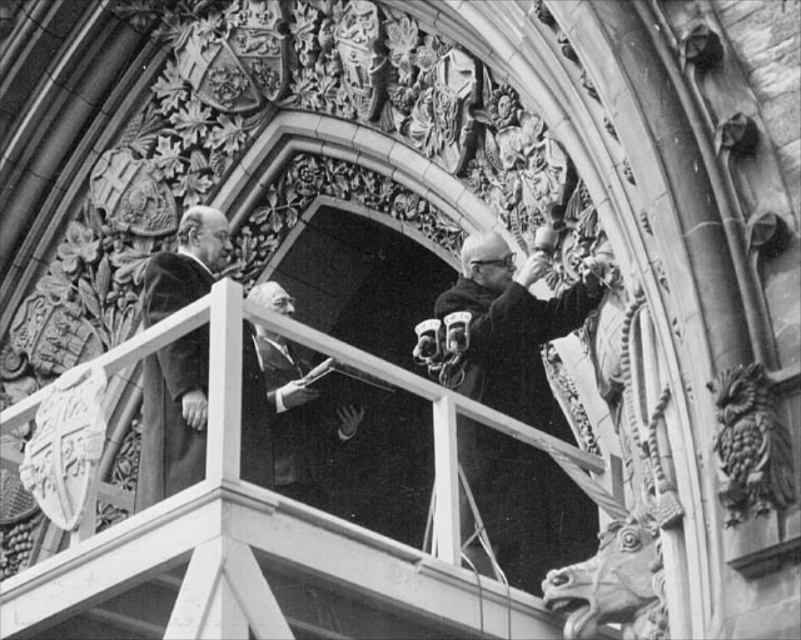
Question: Which of the following is the closest to the observer?

Choices:
 (A) (304, 369)
 (B) (578, 289)
 (C) (155, 260)
 (D) (220, 468)

Answer: (D)

Question: Can you confirm if dark wool coat at center is positioned to the left of smooth black suit at center?

Choices:
 (A) yes
 (B) no

Answer: (B)

Question: Which of the following is the closest to the observer?

Choices:
 (A) smooth wood balcony at center
 (B) velvet-like brown coat at left
 (C) dark wool coat at center
 (D) smooth black suit at center

Answer: (A)

Question: Which object is farther from the camera taking this photo?

Choices:
 (A) velvet-like brown coat at left
 (B) smooth black suit at center

Answer: (B)

Question: Observing the image, what is the correct spatial positioning of smooth wood balcony at center in reference to velvet-like brown coat at left?

Choices:
 (A) right
 (B) left

Answer: (A)

Question: Can you confirm if dark wool coat at center is positioned below smooth black suit at center?

Choices:
 (A) yes
 (B) no

Answer: (B)